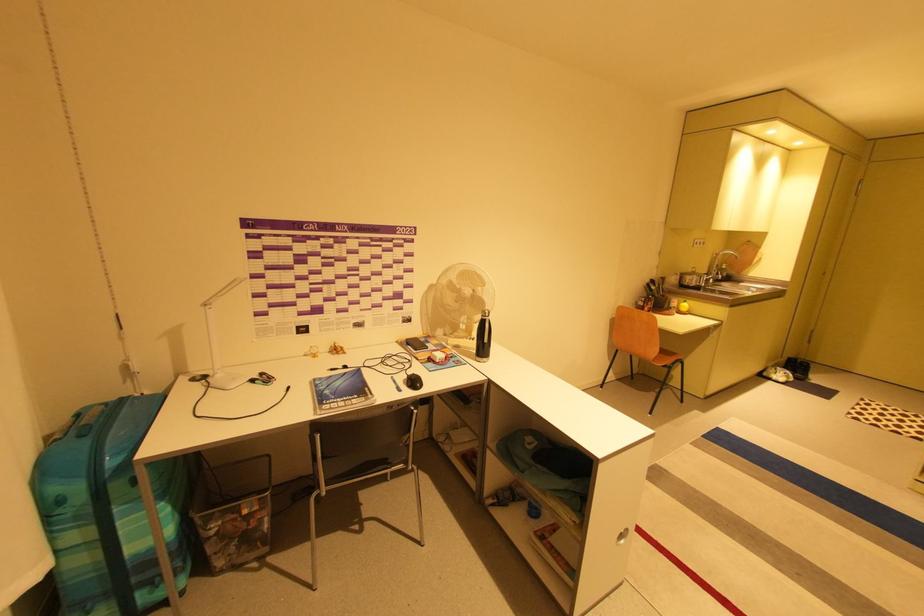
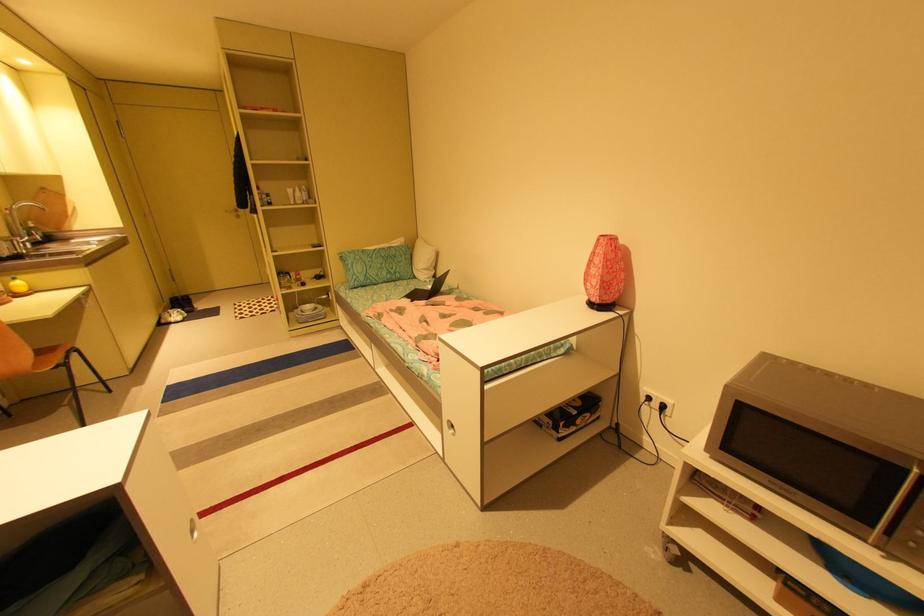
Locate, in the second image, the point that corresponds to (685,310) in the first image.

(19, 293)